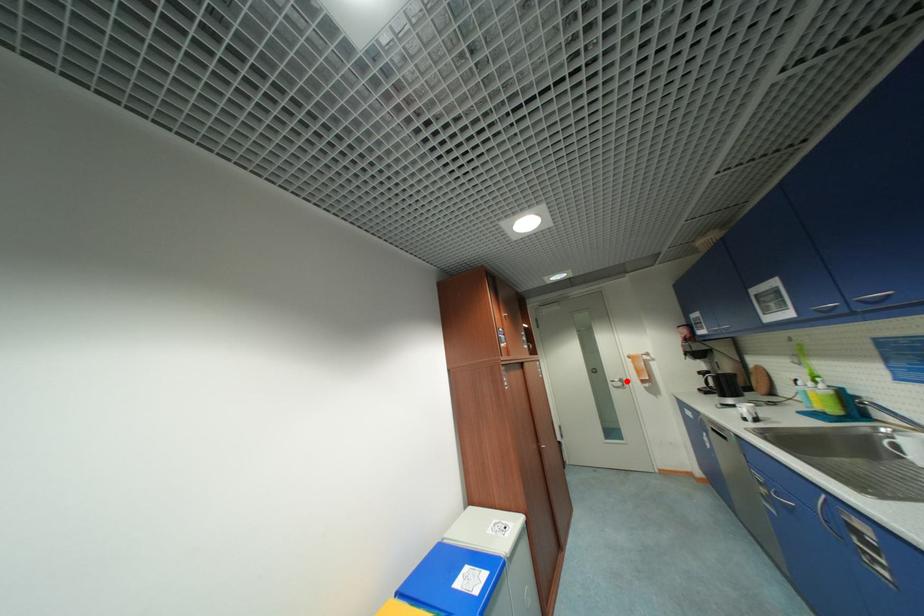
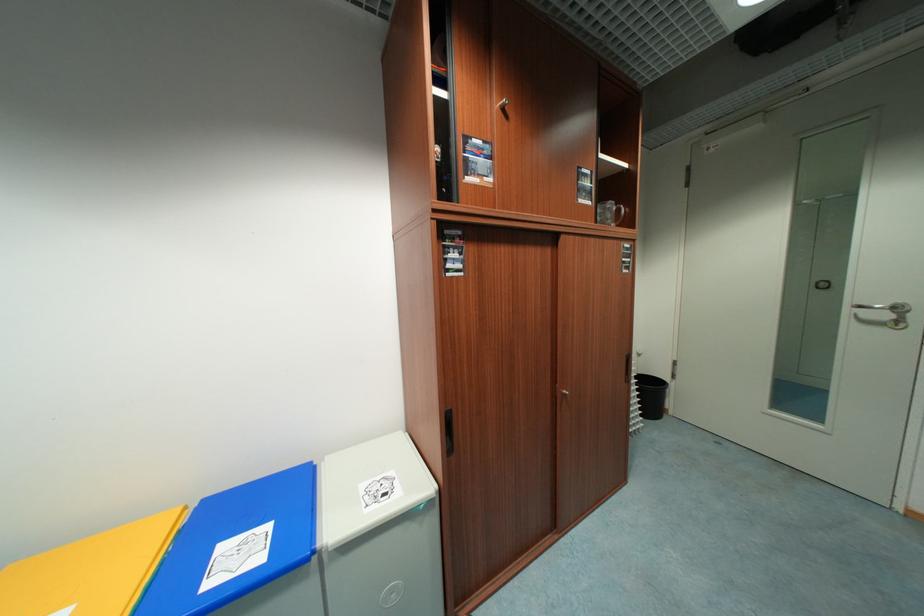
Question: I am providing you with two images of the same scene from different viewpoints. Image1 has a red point marked. In image2, the corresponding 3D location appears at what relative position? Reply with the corresponding letter.

Choices:
 (A) Closer
 (B) Farther

Answer: (A)